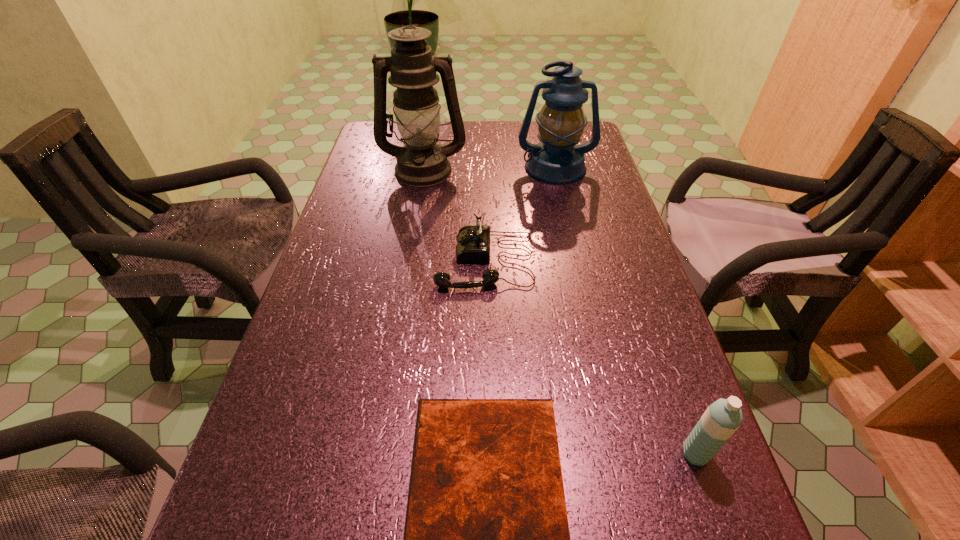
The height and width of the screenshot is (540, 960). In order to click on free space located 0.220m on the dial of the telephone in this screenshot , I will do pos(345,260).

Where is `oil lamp that is at the far edge`? Image resolution: width=960 pixels, height=540 pixels. oil lamp that is at the far edge is located at coordinates (422, 162).

The height and width of the screenshot is (540, 960). Find the location of `lantern that is at the far edge`. lantern that is at the far edge is located at coordinates (557, 159).

I want to click on object located in the left edge section of the desktop, so click(x=422, y=162).

Where is `lantern situated at the right edge`? This screenshot has width=960, height=540. lantern situated at the right edge is located at coordinates (557, 159).

Find the location of a particular element. water bottle present at the right edge is located at coordinates pos(722,418).

Find the location of a particular element. The width and height of the screenshot is (960, 540). object at the far left corner is located at coordinates (422, 162).

Where is `object that is at the far right corner`? This screenshot has width=960, height=540. object that is at the far right corner is located at coordinates (557, 159).

Locate an element on the screen. The image size is (960, 540). free space at the left edge is located at coordinates [x=350, y=272].

Locate an element on the screen. blank area at the right edge is located at coordinates (632, 333).